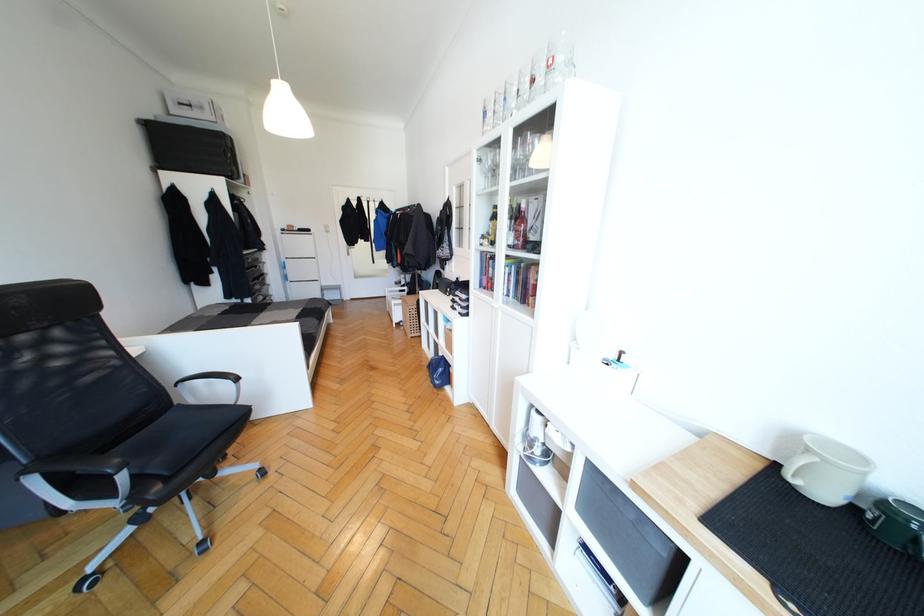
The location [707,506] corresponds to which object?

It refers to a wooden cutting board.